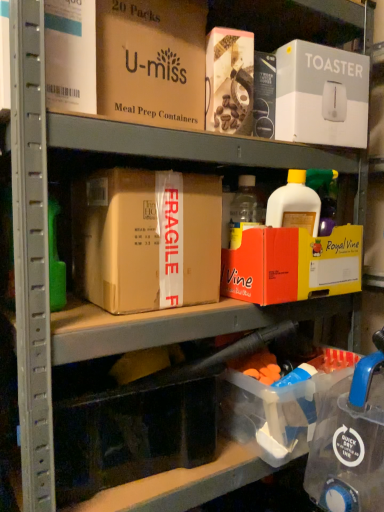
Question: Which direction should I rotate to look at brown cardboard box at center, the third box positioned from the top?

Choices:
 (A) right
 (B) left

Answer: (B)

Question: Would you say brown cardboard box at center, marked as the second box in a bottom-to-top arrangement, contains clear plastic storage box at lower right, the second storage box positioned from the left?

Choices:
 (A) yes
 (B) no

Answer: (B)

Question: From the image's perspective, would you say brown cardboard box at center, the third box positioned from the top, is shown under clear plastic storage box at lower right, which is counted as the 1th storage box, starting from the right?

Choices:
 (A) no
 (B) yes

Answer: (A)

Question: From the image's perspective, would you say brown cardboard box at center, marked as the second box in a bottom-to-top arrangement, is positioned over clear plastic storage box at lower right, which is counted as the 1th storage box, starting from the right?

Choices:
 (A) yes
 (B) no

Answer: (A)

Question: Is brown cardboard box at center, the third box positioned from the top, located outside clear plastic storage box at lower right, the second storage box positioned from the left?

Choices:
 (A) no
 (B) yes

Answer: (B)

Question: Is brown cardboard box at center, marked as the second box in a bottom-to-top arrangement, with clear plastic storage box at lower right, which is counted as the 1th storage box, starting from the right?

Choices:
 (A) no
 (B) yes

Answer: (A)

Question: Does brown cardboard box at center, marked as the second box in a bottom-to-top arrangement, have a greater width compared to clear plastic storage box at lower right, the second storage box positioned from the left?

Choices:
 (A) no
 (B) yes

Answer: (A)

Question: Is brown cardboard box at center, marked as the second box in a bottom-to-top arrangement, taller than orange cardboard box at upper center, placed as the first box when sorted from bottom to top?

Choices:
 (A) no
 (B) yes

Answer: (B)

Question: Does brown cardboard box at center, marked as the second box in a bottom-to-top arrangement, turn towards orange cardboard box at upper center, the fourth box viewed from the top?

Choices:
 (A) yes
 (B) no

Answer: (B)

Question: Does brown cardboard box at center, marked as the second box in a bottom-to-top arrangement, have a smaller size compared to orange cardboard box at upper center, placed as the first box when sorted from bottom to top?

Choices:
 (A) yes
 (B) no

Answer: (B)

Question: Can you confirm if brown cardboard box at center, marked as the second box in a bottom-to-top arrangement, is shorter than orange cardboard box at upper center, the fourth box viewed from the top?

Choices:
 (A) no
 (B) yes

Answer: (A)

Question: From the image's perspective, is brown cardboard box at center, marked as the second box in a bottom-to-top arrangement, beneath orange cardboard box at upper center, the fourth box viewed from the top?

Choices:
 (A) no
 (B) yes

Answer: (A)

Question: Is brown cardboard box at center, the third box positioned from the top, wider than orange cardboard box at upper center, the fourth box viewed from the top?

Choices:
 (A) no
 (B) yes

Answer: (B)

Question: Can you confirm if transparent plastic storage box at lower center, which ranks as the second storage box in right-to-left order, is wider than white cardboard toaster at upper right, the 3th box positioned from the bottom?

Choices:
 (A) yes
 (B) no

Answer: (B)